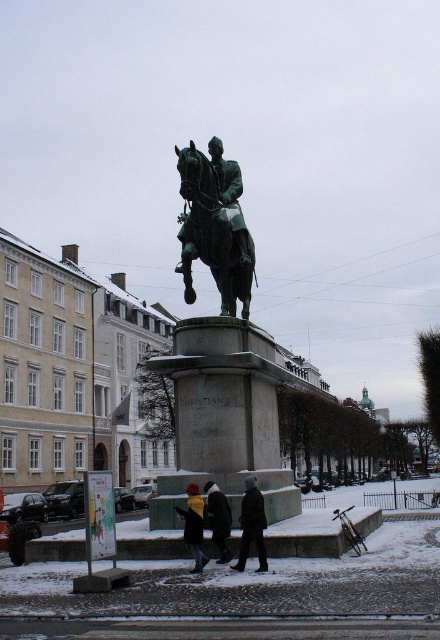
Is point (190, 225) closer to viewer compared to point (242, 525)?

No, it is not.

Who is shorter, green polished metal horse at center or dark gray jacket at center?

dark gray jacket at center

The height and width of the screenshot is (640, 440). What are the coordinates of `green polished metal horse at center` in the screenshot? It's located at (215, 227).

Where is `green polished metal horse at center`? This screenshot has width=440, height=640. green polished metal horse at center is located at coordinates (215, 227).

Can you confirm if dark gray jacket at center is wider than yellow wool sweater at lower center?

Correct, the width of dark gray jacket at center exceeds that of yellow wool sweater at lower center.

Is dark gray jacket at center to the right of yellow wool sweater at lower center from the viewer's perspective?

Indeed, dark gray jacket at center is positioned on the right side of yellow wool sweater at lower center.

This screenshot has width=440, height=640. What do you see at coordinates (252, 525) in the screenshot?
I see `dark gray jacket at center` at bounding box center [252, 525].

Find the location of `dark gray jacket at center`. dark gray jacket at center is located at coordinates click(252, 525).

Who is positioned more to the right, green polished metal horse at center or yellow wool sweater at lower center?

green polished metal horse at center

Can you confirm if green polished metal horse at center is positioned to the left of yellow wool sweater at lower center?

Incorrect, green polished metal horse at center is not on the left side of yellow wool sweater at lower center.

Who is more distant from viewer, [217,200] or [198,493]?

Point [217,200]

The image size is (440, 640). I want to click on green polished metal horse at center, so click(215, 227).